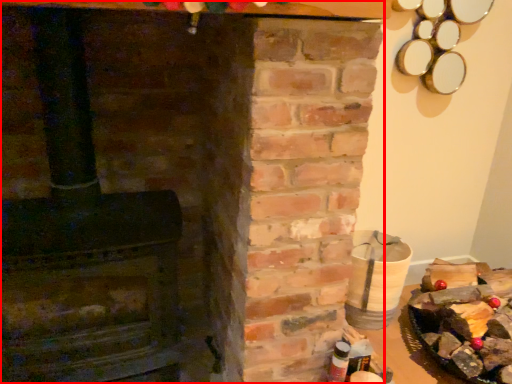
Question: Observing the image, what is the correct spatial positioning of fireplace (annotated by the red box) in reference to food?

Choices:
 (A) left
 (B) right

Answer: (A)